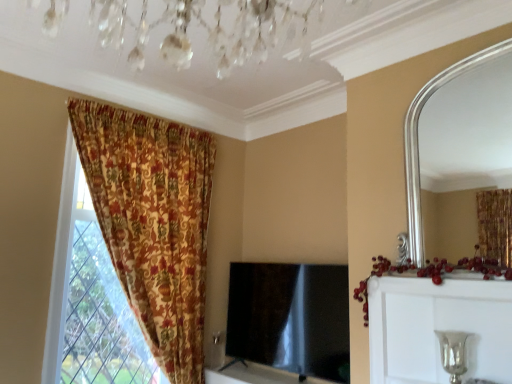
At what (x,y) coordinates should I click in order to perform the action: click on free space above silver metallic vase at upper right (from a real-world perspective). Please return your answer as a coordinate pair (x, y). The height and width of the screenshot is (384, 512). Looking at the image, I should click on (456, 292).